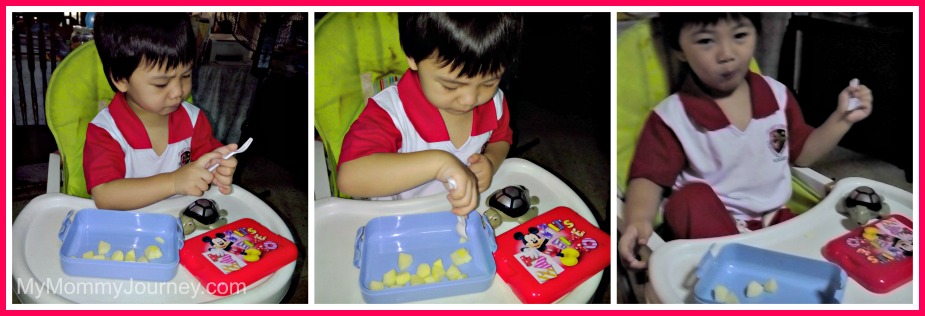
Where is `tray`? Image resolution: width=925 pixels, height=316 pixels. tray is located at coordinates (335, 232).